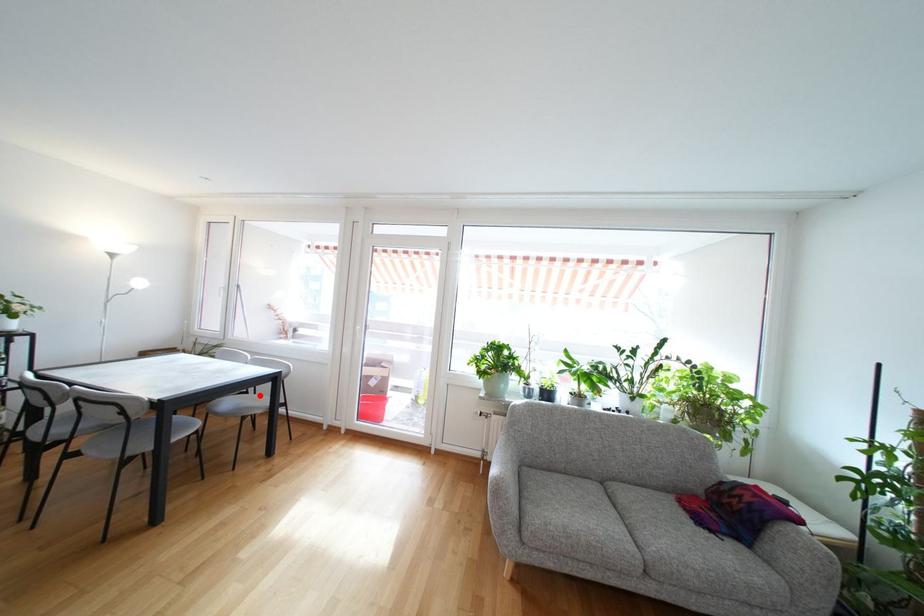
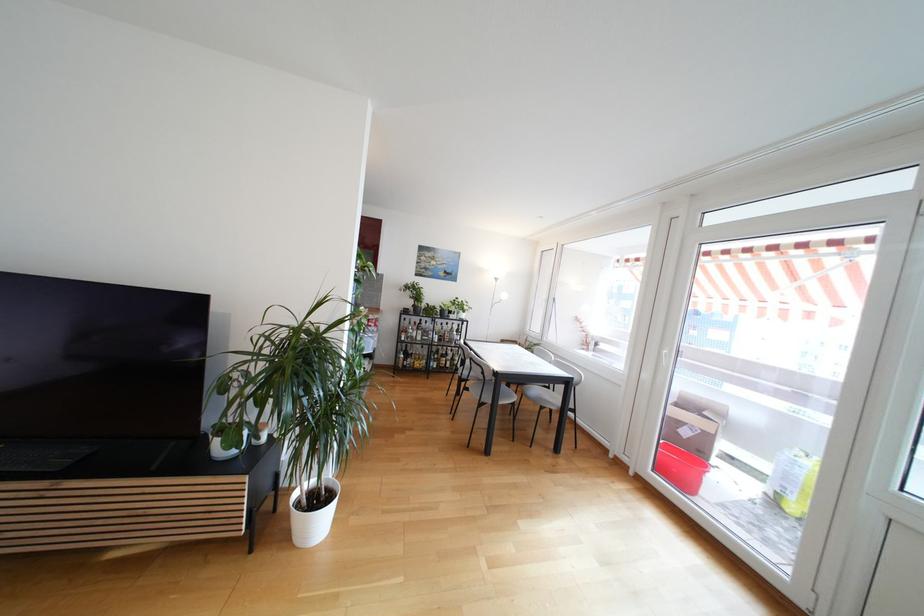
Find the pixel in the second image that matches the highlighted location in the first image.

(557, 392)